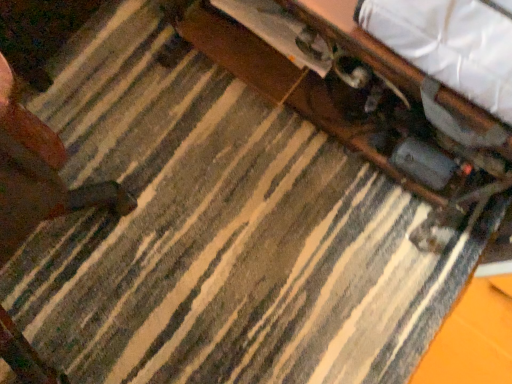
Question: Should I look upward or downward to see wooden drawer at upper center?

Choices:
 (A) down
 (B) up

Answer: (B)

Question: Is wooden table at center thinner than white fabric at upper right?

Choices:
 (A) yes
 (B) no

Answer: (B)

Question: Considering the relative sizes of wooden table at center and white fabric at upper right in the image provided, is wooden table at center taller than white fabric at upper right?

Choices:
 (A) yes
 (B) no

Answer: (A)

Question: Does wooden table at center appear on the right side of white fabric at upper right?

Choices:
 (A) yes
 (B) no

Answer: (B)

Question: From the image's perspective, would you say wooden table at center is shown under white fabric at upper right?

Choices:
 (A) yes
 (B) no

Answer: (B)

Question: Is white fabric at upper right at the back of wooden table at center?

Choices:
 (A) yes
 (B) no

Answer: (B)

Question: Could you tell me if wooden table at center is turned towards white fabric at upper right?

Choices:
 (A) yes
 (B) no

Answer: (B)

Question: Can you confirm if white fabric at upper right is bigger than wooden table at center?

Choices:
 (A) no
 (B) yes

Answer: (A)

Question: Is white fabric at upper right touching wooden table at center?

Choices:
 (A) yes
 (B) no

Answer: (B)

Question: Can you confirm if white fabric at upper right is positioned to the right of wooden table at center?

Choices:
 (A) no
 (B) yes

Answer: (B)

Question: Is white fabric at upper right shorter than wooden table at center?

Choices:
 (A) yes
 (B) no

Answer: (A)

Question: Would you say white fabric at upper right is outside wooden table at center?

Choices:
 (A) no
 (B) yes

Answer: (B)

Question: Can you confirm if white fabric at upper right is smaller than wooden table at center?

Choices:
 (A) yes
 (B) no

Answer: (A)

Question: Does wooden table at center have a greater height compared to wooden drawer at upper center?

Choices:
 (A) no
 (B) yes

Answer: (B)